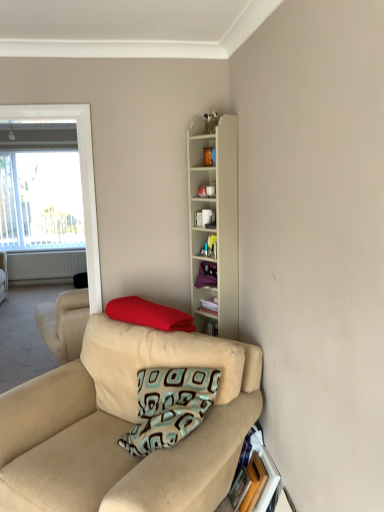
Question: Considering the positions of red fabric pillow at center and beige wood cabinet at upper center in the image, is red fabric pillow at center wider or thinner than beige wood cabinet at upper center?

Choices:
 (A) thin
 (B) wide

Answer: (B)

Question: Considering their positions, is red fabric pillow at center located in front of or behind beige wood cabinet at upper center?

Choices:
 (A) front
 (B) behind

Answer: (A)

Question: Which object is the farthest from the white matte radiator at left?

Choices:
 (A) wooden picture frame at lower right
 (B) beige wood cabinet at upper center
 (C) beige fabric couch at lower left
 (D) red fabric pillow at center

Answer: (A)

Question: Considering the real-world distances, which object is farthest from the beige wood cabinet at upper center?

Choices:
 (A) wooden picture frame at lower right
 (B) beige fabric couch at lower left
 (C) white matte radiator at left
 (D) red fabric pillow at center

Answer: (C)